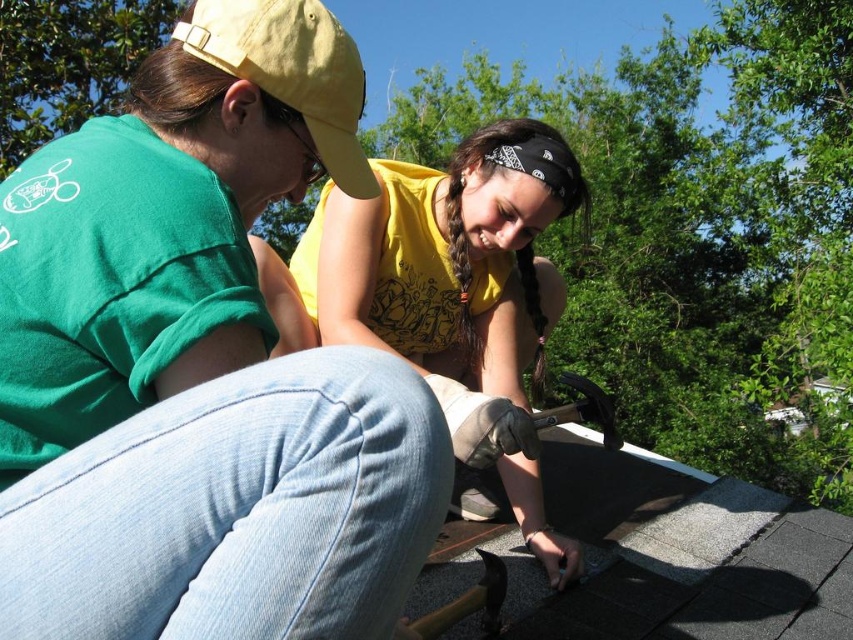
Does point (289, 196) come farther from viewer compared to point (291, 90)?

Yes, point (289, 196) is farther from viewer.

Locate an element on the screen. matte yellow cap at upper left is located at coordinates (199, 365).

Can you confirm if yellow matte shirt at center is positioned below yellow fabric baseball cap at upper left?

Indeed, yellow matte shirt at center is positioned under yellow fabric baseball cap at upper left.

Locate an element on the screen. Image resolution: width=853 pixels, height=640 pixels. yellow matte shirt at center is located at coordinates (445, 259).

The image size is (853, 640). Identify the location of yellow matte shirt at center. (445, 259).

At what (x,y) coordinates should I click in order to perform the action: click on yellow matte shirt at center. Please return your answer as a coordinate pair (x, y). Looking at the image, I should click on (445, 259).

Does matte yellow cap at upper left have a larger size compared to yellow matte shirt at center?

Incorrect, matte yellow cap at upper left is not larger than yellow matte shirt at center.

The height and width of the screenshot is (640, 853). I want to click on matte yellow cap at upper left, so click(199, 365).